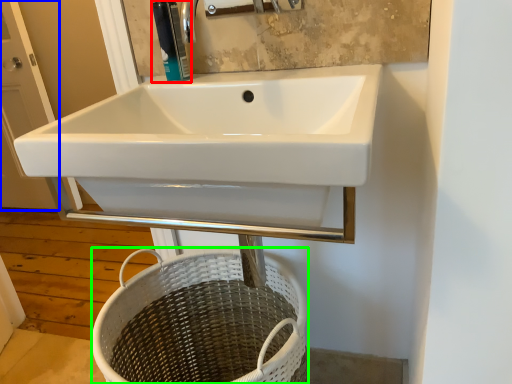
Question: Considering the real-world distances, which object is farthest from soap dispenser (highlighted by a red box)? screen door (highlighted by a blue box) or basket (highlighted by a green box)?

Choices:
 (A) screen door
 (B) basket

Answer: (A)